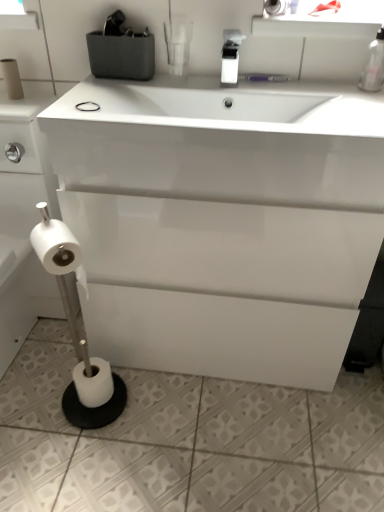
The image size is (384, 512). I want to click on black rubber band at upper center, so click(87, 106).

This screenshot has height=512, width=384. What are the coordinates of `white matte toilet paper at lower left, placed as the 2th toilet paper when sorted from bottom to top` in the screenshot? It's located at (58, 249).

Locate an element on the screen. Image resolution: width=384 pixels, height=512 pixels. white matte toilet paper at left, which is counted as the 4th toilet paper, starting from the right is located at coordinates (11, 78).

This screenshot has height=512, width=384. What do you see at coordinates (222, 222) in the screenshot?
I see `white glossy cabinet at center` at bounding box center [222, 222].

The height and width of the screenshot is (512, 384). What do you see at coordinates (275, 7) in the screenshot? I see `white matte toilet paper at upper center, the 4th toilet paper positioned from the left` at bounding box center [275, 7].

This screenshot has width=384, height=512. In order to click on white glossy soap dispenser at upper center, the 2th bottle in the right-to-left sequence in this screenshot , I will do `click(230, 57)`.

Measure the distance from transparent glass spray bottle at upper right, the 1th bottle in the right-to-left sequence, to white glossy cabinet at center.

transparent glass spray bottle at upper right, the 1th bottle in the right-to-left sequence, is 24.85 inches from white glossy cabinet at center.

Which is more to the left, transparent glass spray bottle at upper right, the 1th bottle in the right-to-left sequence, or white glossy cabinet at center?

white glossy cabinet at center is more to the left.

Where is `the 2nd bottle above when counting from the white glossy cabinet at center (from the image's perspective)`? The image size is (384, 512). the 2nd bottle above when counting from the white glossy cabinet at center (from the image's perspective) is located at coordinates (374, 64).

What's the angular difference between transparent glass spray bottle at upper right, the 1th bottle in the right-to-left sequence, and white glossy cabinet at center's facing directions?

transparent glass spray bottle at upper right, the 1th bottle in the right-to-left sequence, and white glossy cabinet at center are facing 0.298 degrees away from each other.

How distant is white glossy cabinet at center from white matte toilet paper at upper center, the fourth toilet paper from the bottom?

white glossy cabinet at center and white matte toilet paper at upper center, the fourth toilet paper from the bottom, are 26.69 inches apart from each other.

Does white glossy cabinet at center touch white matte toilet paper at upper center, the first toilet paper when ordered from right to left?

white glossy cabinet at center and white matte toilet paper at upper center, the first toilet paper when ordered from right to left, are clearly separated.

Considering the sizes of white glossy cabinet at center and white matte toilet paper at upper center, the first toilet paper when ordered from right to left, in the image, is white glossy cabinet at center wider or thinner than white matte toilet paper at upper center, the first toilet paper when ordered from right to left,?

white glossy cabinet at center is wider than white matte toilet paper at upper center, the first toilet paper when ordered from right to left.

From a real-world perspective, is white glossy cabinet at center over white matte toilet paper at upper center, the 1th toilet paper positioned from the top?

No, from a real-world perspective, white glossy cabinet at center is not above white matte toilet paper at upper center, the 1th toilet paper positioned from the top.

Considering the sizes of objects white matte toilet paper at upper center, the 4th toilet paper positioned from the left, and transparent glass spray bottle at upper right, the 1th bottle in the right-to-left sequence, in the image provided, who is smaller, white matte toilet paper at upper center, the 4th toilet paper positioned from the left, or transparent glass spray bottle at upper right, the 1th bottle in the right-to-left sequence,?

white matte toilet paper at upper center, the 4th toilet paper positioned from the left.

Which object is thinner, white matte toilet paper at upper center, the first toilet paper when ordered from right to left, or transparent glass spray bottle at upper right, positioned as the second bottle in left-to-right order?

transparent glass spray bottle at upper right, positioned as the second bottle in left-to-right order.

Does white matte toilet paper at upper center, the 1th toilet paper positioned from the top, have a lesser height compared to transparent glass spray bottle at upper right, the 1th bottle in the right-to-left sequence?

Correct, white matte toilet paper at upper center, the 1th toilet paper positioned from the top, is not as tall as transparent glass spray bottle at upper right, the 1th bottle in the right-to-left sequence.

Is black rubber band at upper center shorter than transparent glass spray bottle at upper right, positioned as the second bottle in left-to-right order?

Correct, black rubber band at upper center is not as tall as transparent glass spray bottle at upper right, positioned as the second bottle in left-to-right order.

Can we say black rubber band at upper center lies outside transparent glass spray bottle at upper right, the 1th bottle in the right-to-left sequence?

Yes, black rubber band at upper center is located beyond the bounds of transparent glass spray bottle at upper right, the 1th bottle in the right-to-left sequence.

From a real-world perspective, which bottle is the 2nd one above the black rubber band at upper center? Please provide its 2D coordinates.

[(374, 64)]

Would you say black rubber band at upper center is to the left or to the right of transparent glass spray bottle at upper right, the 1th bottle in the right-to-left sequence, in the picture?

Based on their positions, black rubber band at upper center is located to the left of transparent glass spray bottle at upper right, the 1th bottle in the right-to-left sequence.

Does white matte toilet paper at lower left, placed as the 2th toilet paper when sorted from bottom to top, have a lesser height compared to white glossy soap dispenser at upper center, the 2th bottle in the right-to-left sequence?

No, white matte toilet paper at lower left, placed as the 2th toilet paper when sorted from bottom to top, is not shorter than white glossy soap dispenser at upper center, the 2th bottle in the right-to-left sequence.

Can you tell me how much white matte toilet paper at lower left, the 3th toilet paper viewed from the right, and white glossy soap dispenser at upper center, which is counted as the 1th bottle, starting from the left, differ in facing direction?

They differ by 51.2 degrees in their facing directions.

Which is in front, white matte toilet paper at lower left, arranged as the third toilet paper when viewed from the top, or white glossy soap dispenser at upper center, the 2th bottle in the right-to-left sequence?

Positioned in front is white matte toilet paper at lower left, arranged as the third toilet paper when viewed from the top.

Could you tell me if white matte toilet paper at lower left, placed as the 2th toilet paper when sorted from bottom to top, is turned towards white glossy soap dispenser at upper center, which is counted as the 1th bottle, starting from the left?

No.

Which object is positioned more to the left, transparent plastic window screen at upper left or white matte toilet paper at lower left, which ranks as the 4th toilet paper in top-to-bottom order?

transparent plastic window screen at upper left is more to the left.

Could you measure the distance between transparent plastic window screen at upper left and white matte toilet paper at lower left, positioned as the first toilet paper in bottom-to-top order?

They are 1.04 meters apart.

Between transparent plastic window screen at upper left and white matte toilet paper at lower left, positioned as the first toilet paper in bottom-to-top order, which one has smaller size?

white matte toilet paper at lower left, positioned as the first toilet paper in bottom-to-top order.

Is white glossy soap dispenser at upper center, which is counted as the 1th bottle, starting from the left, facing away from white glossy cabinet at center?

white glossy soap dispenser at upper center, which is counted as the 1th bottle, starting from the left, is not turned away from white glossy cabinet at center.

From the image's perspective, is white glossy soap dispenser at upper center, which is counted as the 1th bottle, starting from the left, located beneath white glossy cabinet at center?

Result: No, from the image's perspective, white glossy soap dispenser at upper center, which is counted as the 1th bottle, starting from the left, is not below white glossy cabinet at center.

Locate an element on the screen. bathroom cabinet on the left of white glossy soap dispenser at upper center, which is counted as the 1th bottle, starting from the left is located at coordinates (222, 222).

Identify the location of the 1st bottle behind the white glossy cabinet at center, counting from the anchor's position. This screenshot has width=384, height=512. (374, 64).

The height and width of the screenshot is (512, 384). What are the coordinates of `bathroom cabinet below the white matte toilet paper at upper center, the 1th toilet paper positioned from the top (from a real-world perspective)` in the screenshot? It's located at (222, 222).

From the image, which object appears to be nearer to white matte toilet paper at left, the 3th toilet paper ordered from the bottom, white glossy soap dispenser at upper center, the 2th bottle in the right-to-left sequence, or transparent glass spray bottle at upper right, positioned as the second bottle in left-to-right order?

white glossy soap dispenser at upper center, the 2th bottle in the right-to-left sequence.

Estimate the real-world distances between objects in this image. Which object is closer to white glossy cabinet at center, white matte toilet paper at left, the 3th toilet paper ordered from the bottom, or white matte toilet paper at lower left, the 3th toilet paper viewed from the right?

white matte toilet paper at lower left, the 3th toilet paper viewed from the right, is positioned closer to the anchor white glossy cabinet at center.

Looking at the image, which one is located closer to black rubber band at upper center, transparent plastic window screen at upper left or white glossy soap dispenser at upper center, which is counted as the 1th bottle, starting from the left?

The object closer to black rubber band at upper center is white glossy soap dispenser at upper center, which is counted as the 1th bottle, starting from the left.

Based on their spatial positions, is white matte toilet paper at lower left, the 2th toilet paper viewed from the right, or white matte toilet paper at upper center, the 4th toilet paper positioned from the left, further from white matte toilet paper at left, which is counted as the 4th toilet paper, starting from the right?

white matte toilet paper at lower left, the 2th toilet paper viewed from the right, is positioned further to the anchor white matte toilet paper at left, which is counted as the 4th toilet paper, starting from the right.

Considering their positions, is white glossy soap dispenser at upper center, the 2th bottle in the right-to-left sequence, positioned closer to white matte toilet paper at left, which is counted as the 2th toilet paper, starting from the top, than white matte toilet paper at lower left, the 2th toilet paper viewed from the right?

white glossy soap dispenser at upper center, the 2th bottle in the right-to-left sequence, is closer to white matte toilet paper at left, which is counted as the 2th toilet paper, starting from the top.

From the image, which object appears to be farther from white glossy soap dispenser at upper center, which is counted as the 1th bottle, starting from the left, white glossy cabinet at center or white matte toilet paper at left, which is counted as the 1th toilet paper, starting from the left?

white matte toilet paper at left, which is counted as the 1th toilet paper, starting from the left, is positioned further to the anchor white glossy soap dispenser at upper center, which is counted as the 1th bottle, starting from the left.

Estimate the real-world distances between objects in this image. Which object is closer to white matte toilet paper at lower left, arranged as the third toilet paper when viewed from the top, black rubber band at upper center or white matte toilet paper at lower left, the 2th toilet paper viewed from the right?

Based on the image, black rubber band at upper center appears to be nearer to white matte toilet paper at lower left, arranged as the third toilet paper when viewed from the top.

From the picture: Estimate the real-world distances between objects in this image. Which object is closer to transparent plastic window screen at upper left, white glossy cabinet at center or white matte toilet paper at upper center, the fourth toilet paper from the bottom?

The object closer to transparent plastic window screen at upper left is white matte toilet paper at upper center, the fourth toilet paper from the bottom.

Find the location of a particular element. The image size is (384, 512). soap between white matte toilet paper at upper center, the fourth toilet paper from the bottom, and white matte toilet paper at lower left, placed as the 2th toilet paper when sorted from bottom to top, in the up-down direction is located at coordinates (87, 106).

This screenshot has height=512, width=384. Find the location of `bathroom cabinet between white matte toilet paper at upper center, the 4th toilet paper positioned from the left, and white matte toilet paper at lower left, the 2th toilet paper viewed from the right, from top to bottom`. bathroom cabinet between white matte toilet paper at upper center, the 4th toilet paper positioned from the left, and white matte toilet paper at lower left, the 2th toilet paper viewed from the right, from top to bottom is located at coordinates (222, 222).

Where is `bathroom cabinet between white matte toilet paper at lower left, the 3th toilet paper viewed from the right, and transparent glass spray bottle at upper right, positioned as the second bottle in left-to-right order, from left to right`? The height and width of the screenshot is (512, 384). bathroom cabinet between white matte toilet paper at lower left, the 3th toilet paper viewed from the right, and transparent glass spray bottle at upper right, positioned as the second bottle in left-to-right order, from left to right is located at coordinates (222, 222).

Locate an element on the screen. The height and width of the screenshot is (512, 384). soap located between transparent plastic window screen at upper left and white glossy soap dispenser at upper center, which is counted as the 1th bottle, starting from the left, in the left-right direction is located at coordinates (87, 106).